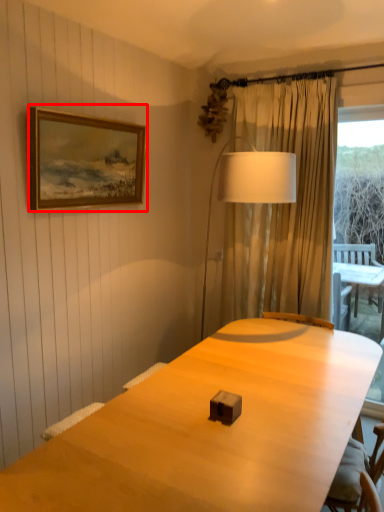
Question: From the image, what is the correct spatial relationship of picture frame (annotated by the red box) in relation to table lamp?

Choices:
 (A) left
 (B) right

Answer: (A)